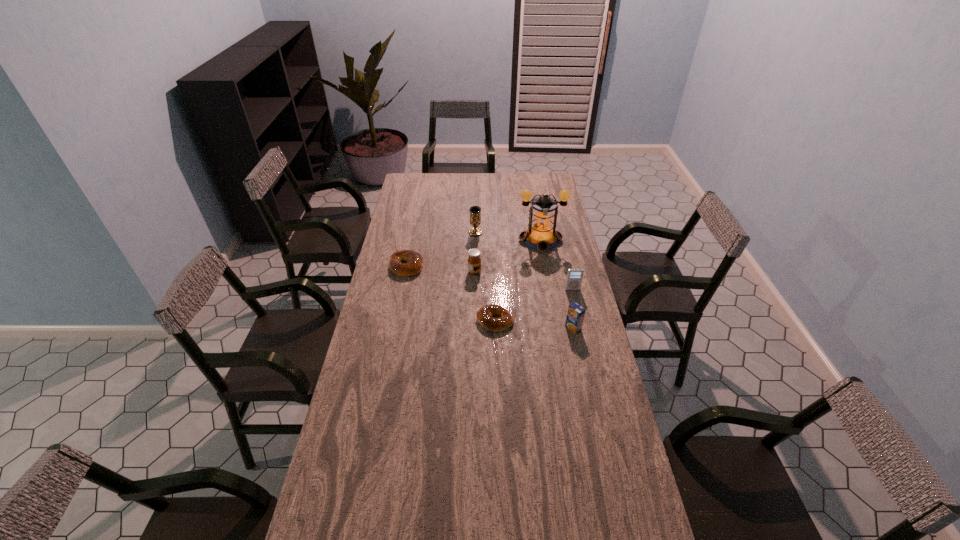
The height and width of the screenshot is (540, 960). Identify the location of free space located on the left of the shortest object. (409, 321).

At what (x,y) coordinates should I click in order to perform the action: click on vacant space located 0.240m on the front-facing side of the lantern. Please return your answer as a coordinate pair (x, y). Image resolution: width=960 pixels, height=540 pixels. Looking at the image, I should click on (549, 288).

This screenshot has height=540, width=960. Identify the location of vacant space located 0.220m on the left of the second tallest object. (424, 233).

Identify the location of vacant space situated on the front-facing side of the honey. The height and width of the screenshot is (540, 960). click(x=548, y=272).

Where is `blank area located on the front-facing side of the iPod`? blank area located on the front-facing side of the iPod is located at coordinates (579, 318).

The width and height of the screenshot is (960, 540). Identify the location of vacant space located 0.150m on the left of the orange_juice. (527, 328).

Find the location of `object located in the left edge section of the desktop`. object located in the left edge section of the desktop is located at coordinates (414, 260).

Identify the location of lantern located at the right edge. The height and width of the screenshot is (540, 960). (541, 235).

At what (x,y) coordinates should I click in order to perform the action: click on iPod located at the right edge. Please return your answer as a coordinate pair (x, y). The width and height of the screenshot is (960, 540). Looking at the image, I should click on (574, 276).

The height and width of the screenshot is (540, 960). What are the coordinates of `orange_juice that is at the right edge` in the screenshot? It's located at (575, 315).